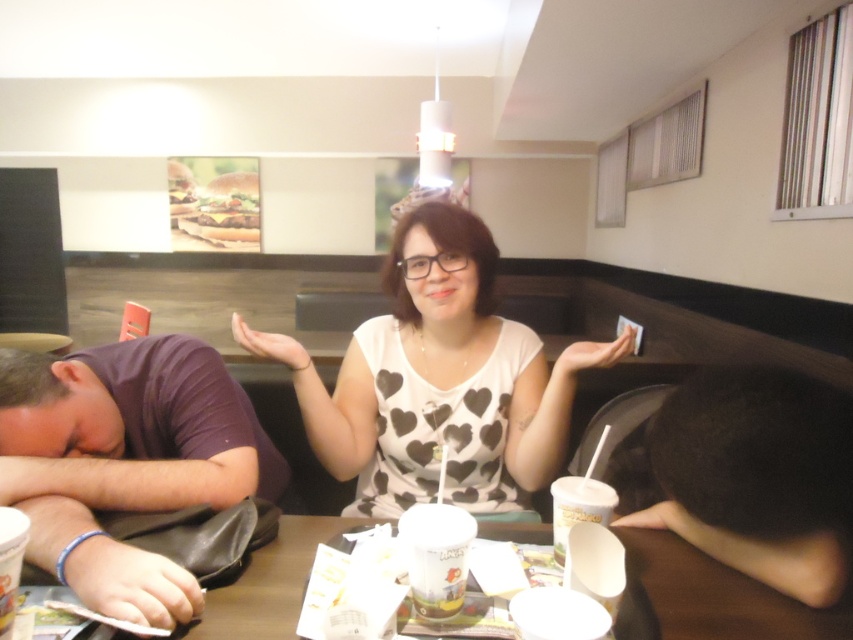
Question: Is dark brown hair at lower right behind white paper cup at center?

Choices:
 (A) no
 (B) yes

Answer: (A)

Question: Which object is positioned closest to the white paper cup at center?

Choices:
 (A) white paper cup at lower center
 (B) white heart-patterned shirt at center
 (C) dark brown hair at lower right

Answer: (A)

Question: Does dark brown hair at lower right appear on the right side of brown paper table at center?

Choices:
 (A) no
 (B) yes

Answer: (B)

Question: Which of the following is the farthest from the observer?

Choices:
 (A) dark brown hair at lower right
 (B) white heart-patterned shirt at center
 (C) white paper cup at center

Answer: (B)

Question: Observing the image, what is the correct spatial positioning of white paper cup at center in reference to white paper cup at lower center?

Choices:
 (A) below
 (B) above

Answer: (B)

Question: Estimate the real-world distances between objects in this image. Which object is farther from the brown paper table at center?

Choices:
 (A) white heart-patterned shirt at center
 (B) white paper cup at lower center
 (C) dark brown hair at lower right

Answer: (A)